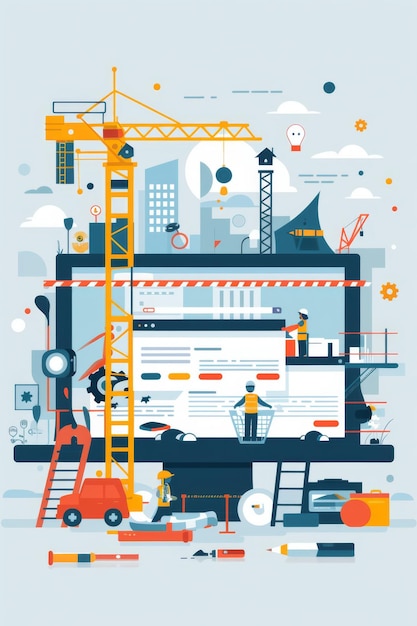
The height and width of the screenshot is (626, 417). In order to click on lightbulb in this screenshot , I will do [x=296, y=130].